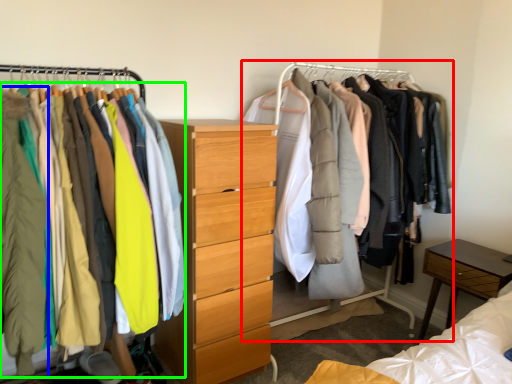
Question: Which is nearer to the closet (highlighted by a red box)? clothing (highlighted by a blue box) or clothing (highlighted by a green box).

Choices:
 (A) clothing
 (B) clothing

Answer: (B)